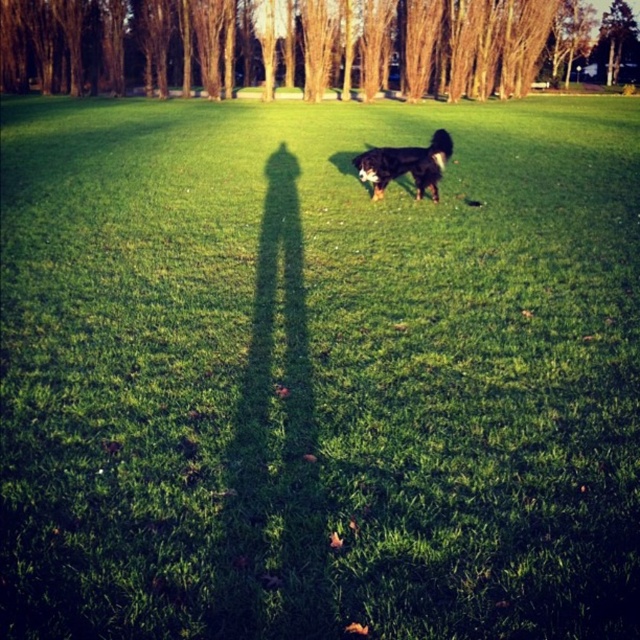
You are a hiker who wants to take a photo of the brown bark tree at center and the black shaggy dog at center. If you are standing at the photographer shadow, which object is closer to you?

The black shaggy dog at center is closer to you since it is only 56.72 meters away from the brown bark tree at center, so the dog is nearer to your position at the shadow.

You are a photographer trying to capture a clear photo of the black shaggy dog at center without the brown bark tree at center blocking it. Based on the scene description, can you adjust your position to achieve this?

The black shaggy dog at center is behind the brown bark tree at center, so moving to a position where the tree is no longer between you and the dog would allow for an unobstructed view. For example, moving to the side opposite of the tree might help you position yourself so the dog is visible without the tree blocking it.